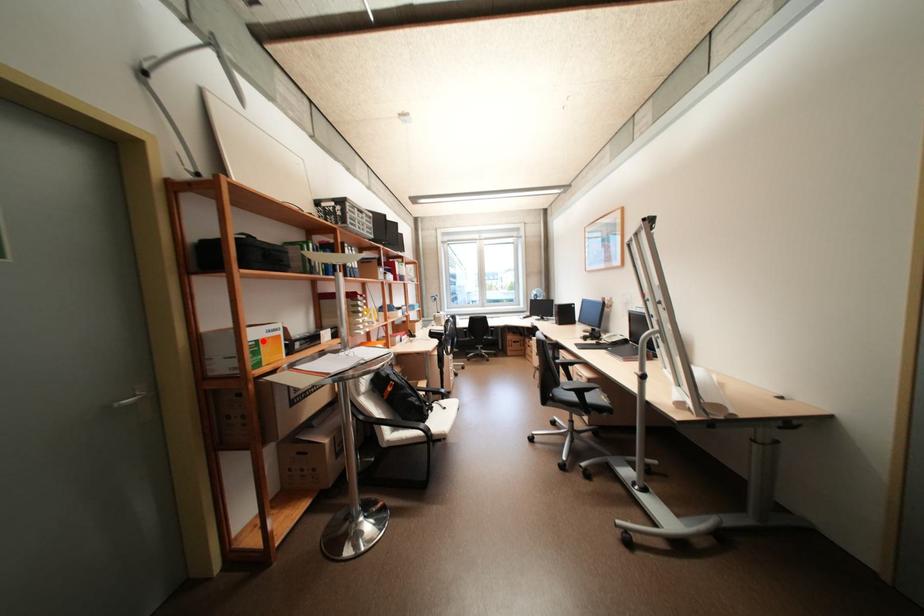
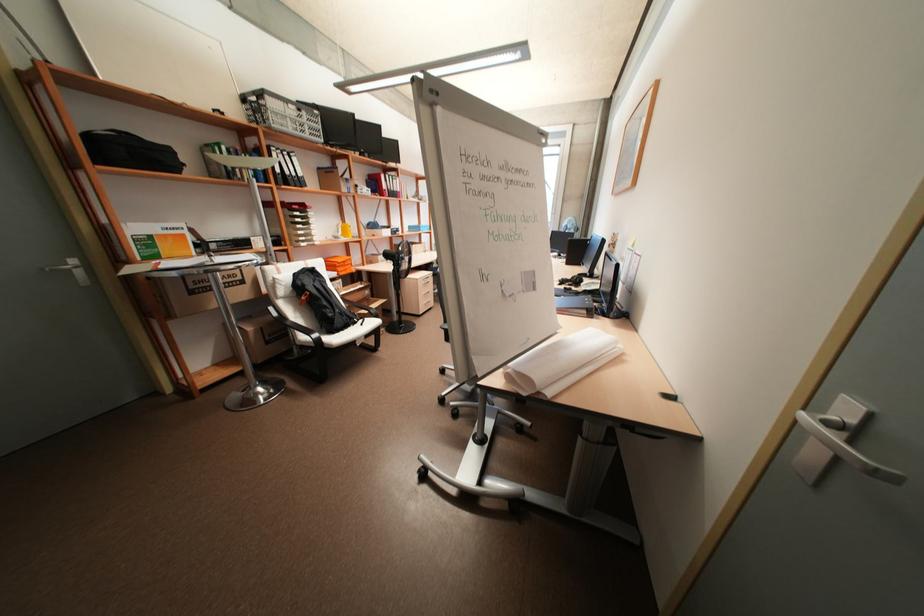
Where in the second image is the point corresponding to the highlighted location from the first image?

(155, 236)